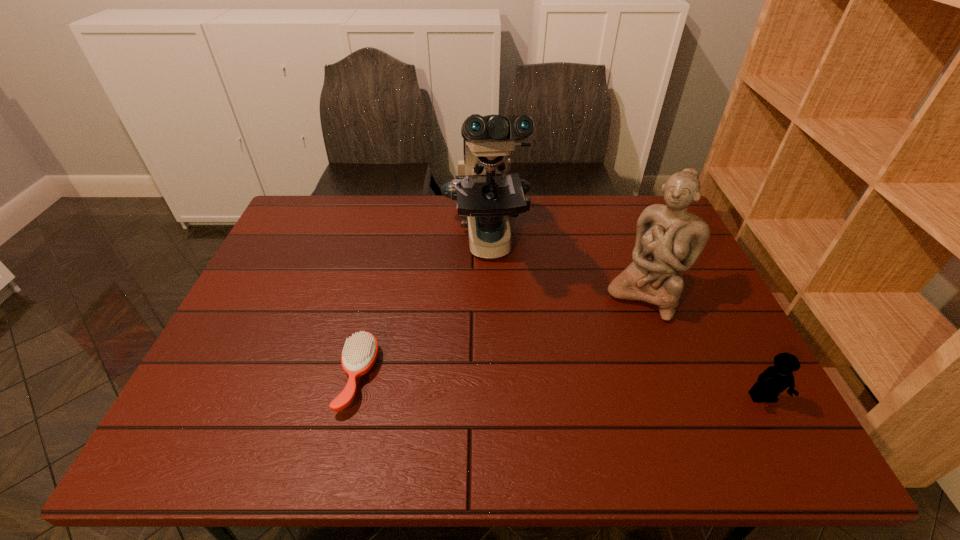
Where is `free space between the Lego and the second object from right to left`? The image size is (960, 540). free space between the Lego and the second object from right to left is located at coordinates (704, 347).

Identify the location of free space between the second shortest object and the shortest object. click(561, 387).

At what (x,y) coordinates should I click in order to perform the action: click on vacant space in between the tallest object and the second shortest object. Please return your answer as a coordinate pair (x, y). Looking at the image, I should click on (624, 319).

Locate an element on the screen. The height and width of the screenshot is (540, 960). free spot between the third object from right to left and the third shortest object is located at coordinates (565, 268).

Find the location of a particular element. vacant region between the rightmost object and the third shortest object is located at coordinates (704, 347).

Locate an element on the screen. vacant space in between the second object from left to right and the hairbrush is located at coordinates (422, 309).

You are a GUI agent. You are given a task and a screenshot of the screen. Output one action in this format:
    pyautogui.click(x=<x>, y=<y>)
    Task: Click on the free space between the microscope and the second object from right to left
    
    Given the screenshot: What is the action you would take?
    pyautogui.click(x=565, y=268)

Identify which object is the second closest to the second tallest object. Please provide its 2D coordinates. Your answer should be formatted as a tuple, i.e. [(x, y)], where the tuple contains the x and y coordinates of a point satisfying the conditions above.

[(775, 379)]

At what (x,y) coordinates should I click in order to perform the action: click on the third closest object to the second object from right to left. Please return your answer as a coordinate pair (x, y). The image size is (960, 540). Looking at the image, I should click on (359, 354).

Where is `vacant position in the image that satisfies the following two spatial constraints: 1. on the front side of the third object from right to left; 2. on the left side of the third object from left to right`? The image size is (960, 540). vacant position in the image that satisfies the following two spatial constraints: 1. on the front side of the third object from right to left; 2. on the left side of the third object from left to right is located at coordinates (487, 296).